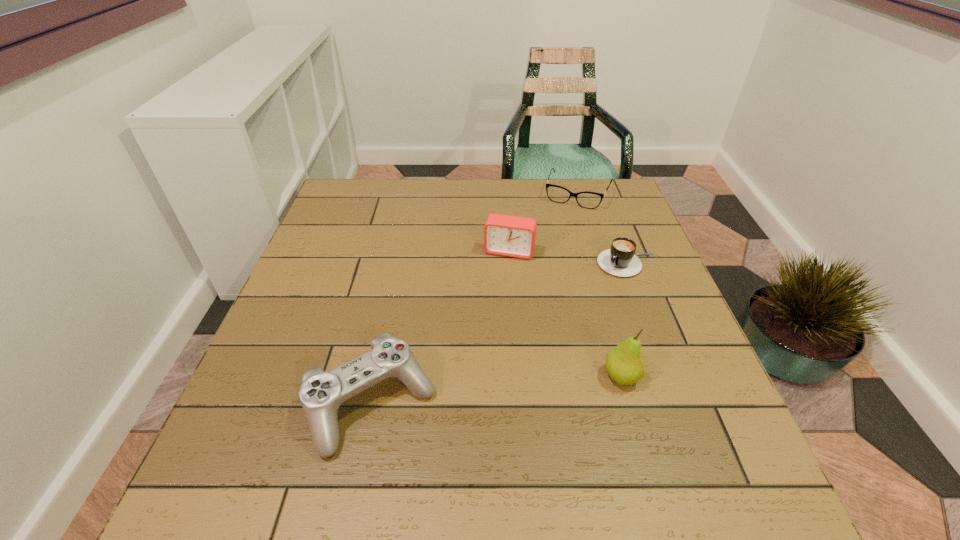
Find the location of a particular element. This screenshot has height=540, width=960. the third shortest object is located at coordinates (321, 394).

This screenshot has height=540, width=960. In order to click on control in this screenshot , I will do `click(321, 394)`.

Identify the location of pear. The height and width of the screenshot is (540, 960). (624, 364).

Where is `the fourth object from right to left`? This screenshot has width=960, height=540. the fourth object from right to left is located at coordinates (505, 235).

Identify the location of the second tallest object. The width and height of the screenshot is (960, 540). (505, 235).

Where is `spectacles`? spectacles is located at coordinates (590, 200).

Locate an element on the screen. Image resolution: width=960 pixels, height=540 pixels. cappuccino is located at coordinates (619, 260).

I want to click on vacant region located on the back of the tallest object, so click(599, 299).

Locate an element on the screen. This screenshot has height=540, width=960. vacant region located on the front-facing side of the second object from left to right is located at coordinates (487, 320).

The width and height of the screenshot is (960, 540). In order to click on vacant space located on the front-facing side of the second object from left to right in this screenshot , I will do `click(489, 313)`.